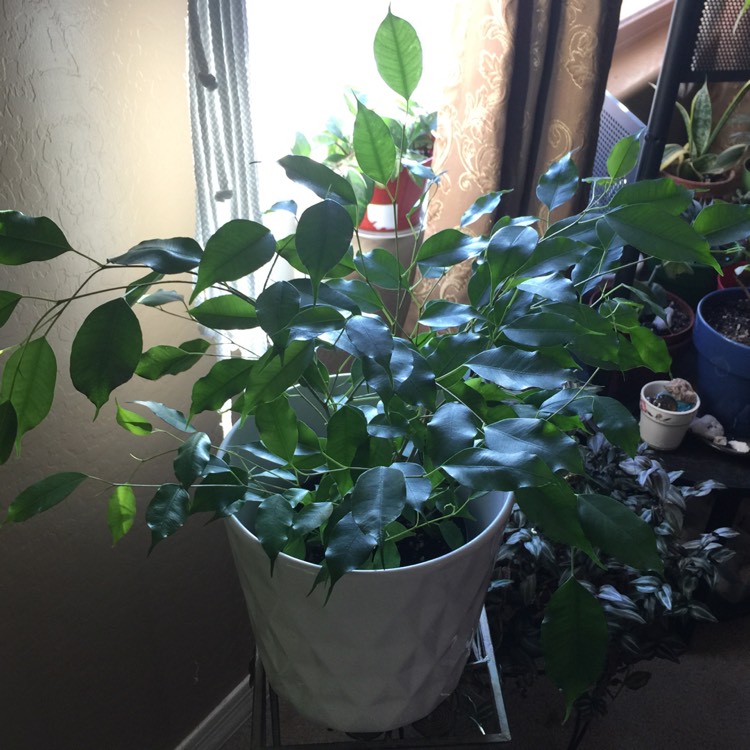
Where is `drapes`? The height and width of the screenshot is (750, 750). drapes is located at coordinates (568, 82).